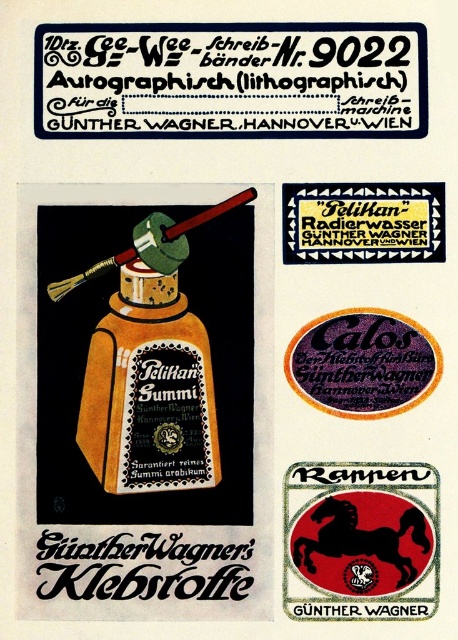
You are examining the vintage advertisement for GUNTHER WAGNER Klebstoffe. There are two points marked in the image. The first is at coordinate point (119,308) and the second is at coordinate point (385,582). From your perspective, which point is closer to you?

Point (119,308) is closer to you because it is further to the viewer than point (385,582).

You are designing a layout for a new adhesive product and need to place the matte gold bottle at center and black paper sticker at upper center in a way that maintains their relative sizes as shown in the original advertisement. Which object should be placed higher up to ensure proper scaling?

The matte gold bottle at center is taller than the black paper sticker at upper center, so to maintain proper scaling, the matte gold bottle at center should be placed higher up to account for its greater height.